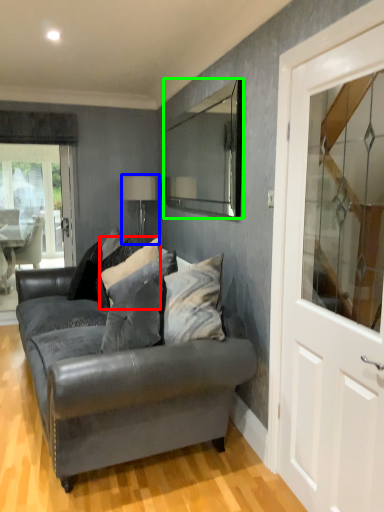
Question: Which object is the farthest from pillow (highlighted by a red box)? Choose among these: lamp (highlighted by a blue box) or mirror (highlighted by a green box).

Choices:
 (A) lamp
 (B) mirror

Answer: (B)